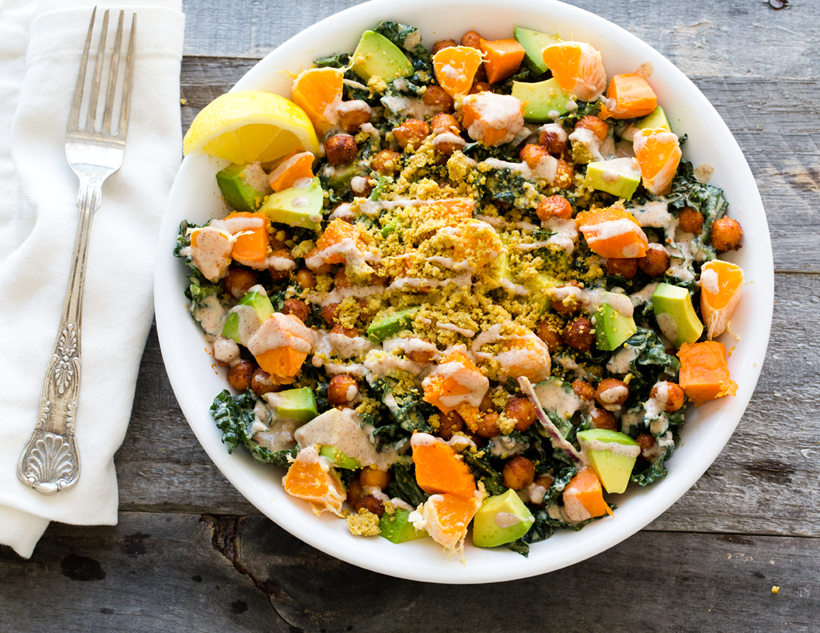
The height and width of the screenshot is (633, 820). Identify the location of napkin. (121, 316).